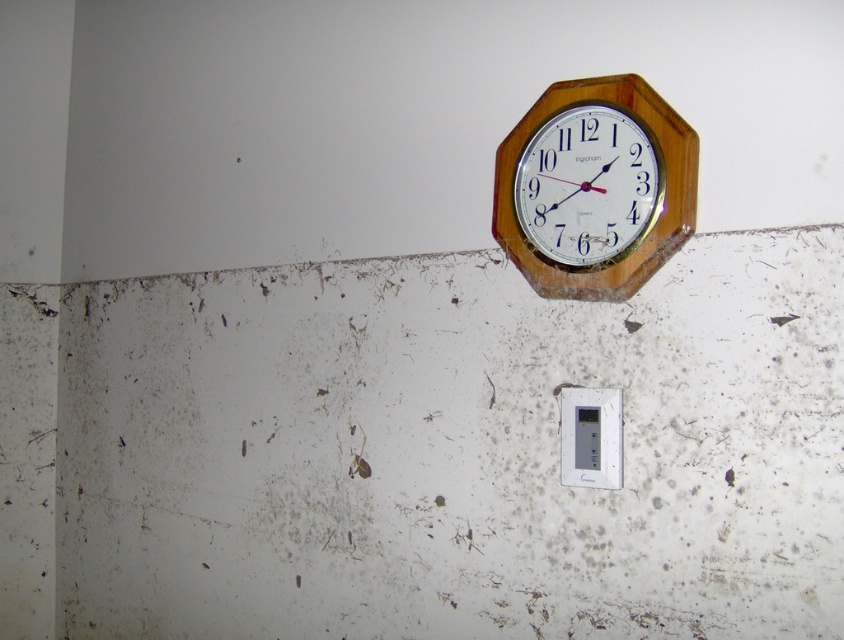
Looking at this image, does wooden clock at upper right appear on the right side of white plastic electric outlet at center?

In fact, wooden clock at upper right is to the left of white plastic electric outlet at center.

Image resolution: width=844 pixels, height=640 pixels. What do you see at coordinates (594, 188) in the screenshot?
I see `wooden clock at upper right` at bounding box center [594, 188].

Identify the location of wooden clock at upper right. (594, 188).